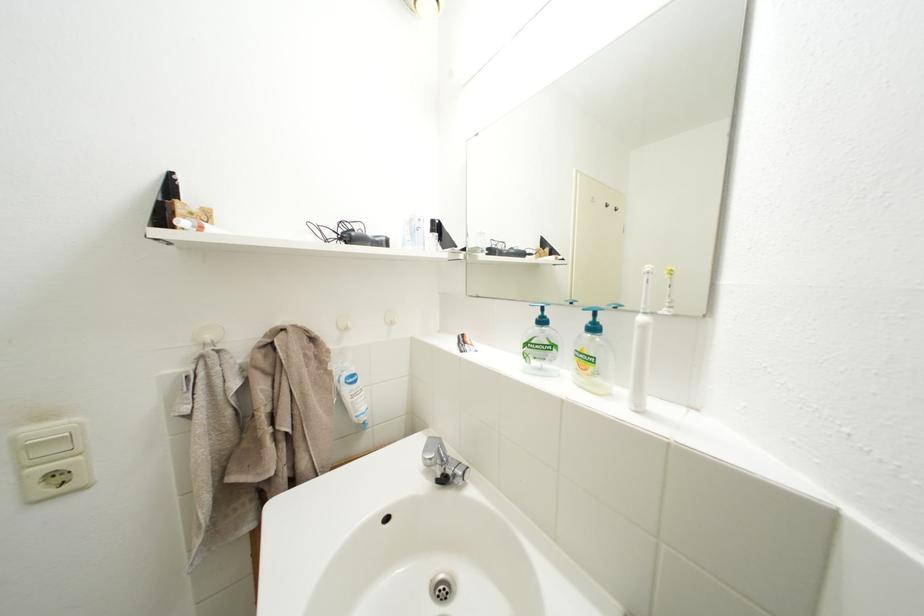
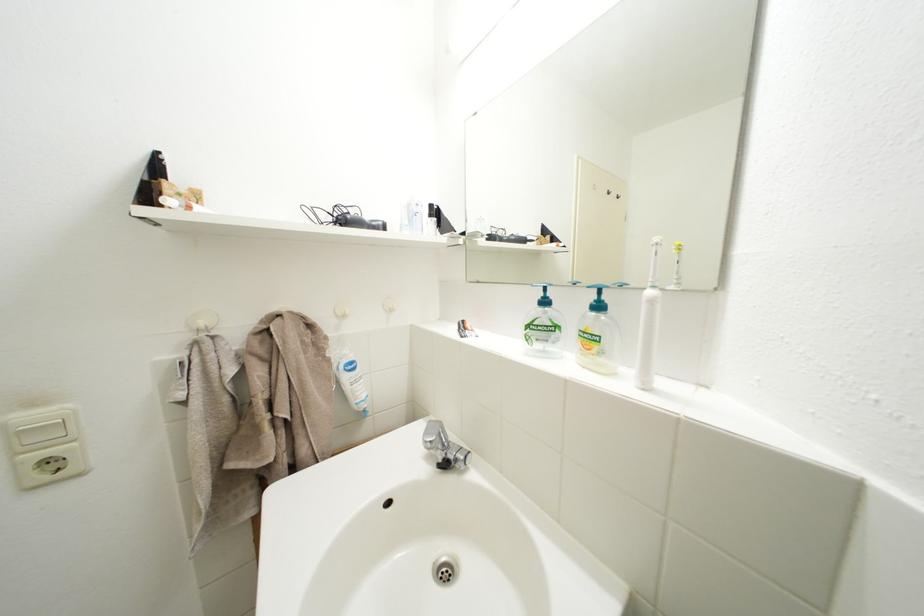
Find the pixel in the second image that matches [650,323] in the first image.

(659, 298)